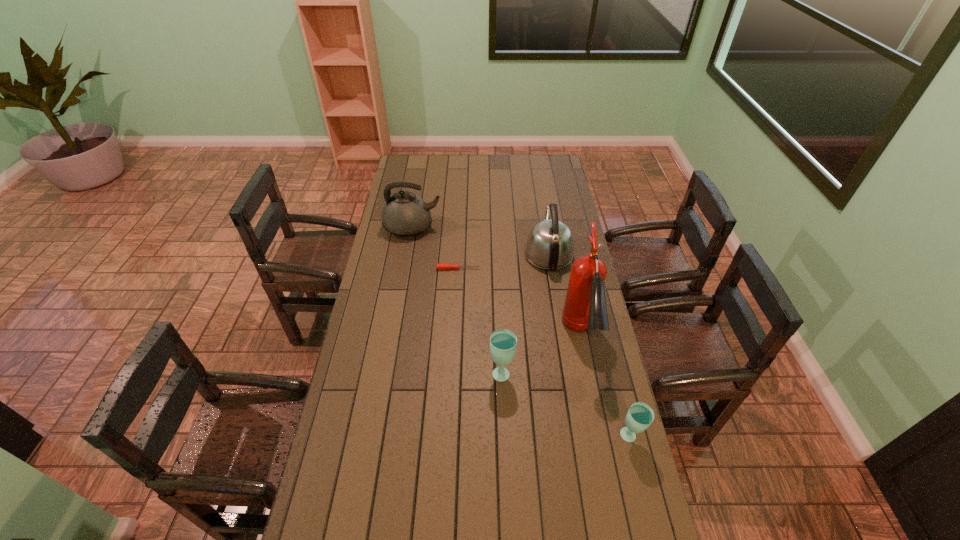
Locate an element on the screen. Image resolution: width=960 pixels, height=540 pixels. free space for a new glass on the left is located at coordinates (398, 320).